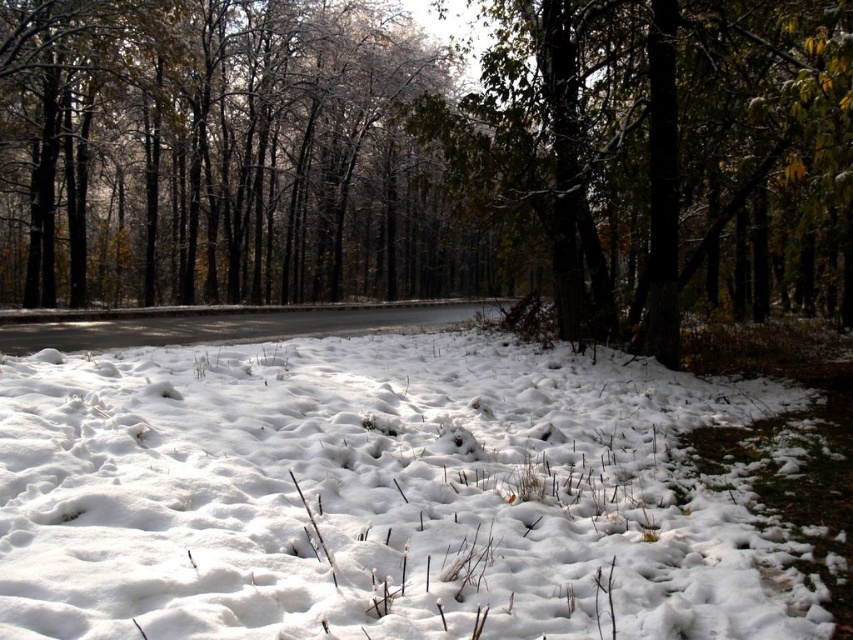
Question: Based on their relative distances, which object is farther from the snow-covered tree at center?

Choices:
 (A) frosty bark trees at center
 (B) white fluffy snow at center

Answer: (A)

Question: Which of these objects is positioned farthest from the frosty bark trees at center?

Choices:
 (A) snow-covered tree at center
 (B) white fluffy snow at center

Answer: (B)

Question: Is white fluffy snow at center positioned at the back of frosty bark trees at center?

Choices:
 (A) no
 (B) yes

Answer: (A)

Question: Is white fluffy snow at center wider than frosty bark trees at center?

Choices:
 (A) yes
 (B) no

Answer: (B)

Question: Does white fluffy snow at center come behind frosty bark trees at center?

Choices:
 (A) yes
 (B) no

Answer: (B)

Question: Which of the following is the closest to the observer?

Choices:
 (A) (44, 588)
 (B) (294, 292)
 (C) (572, 316)

Answer: (A)